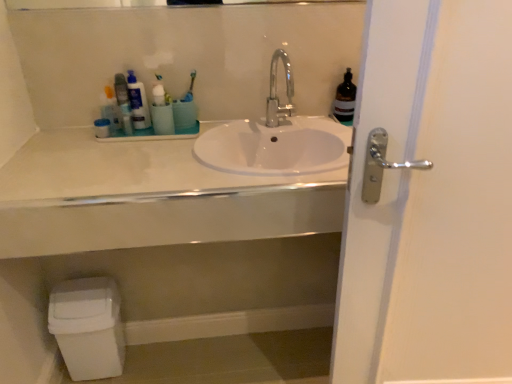
The height and width of the screenshot is (384, 512). In order to click on free spot in front of matte plastic container at upper left, placed as the first toiletry when sorted from left to right in this screenshot , I will do `click(91, 147)`.